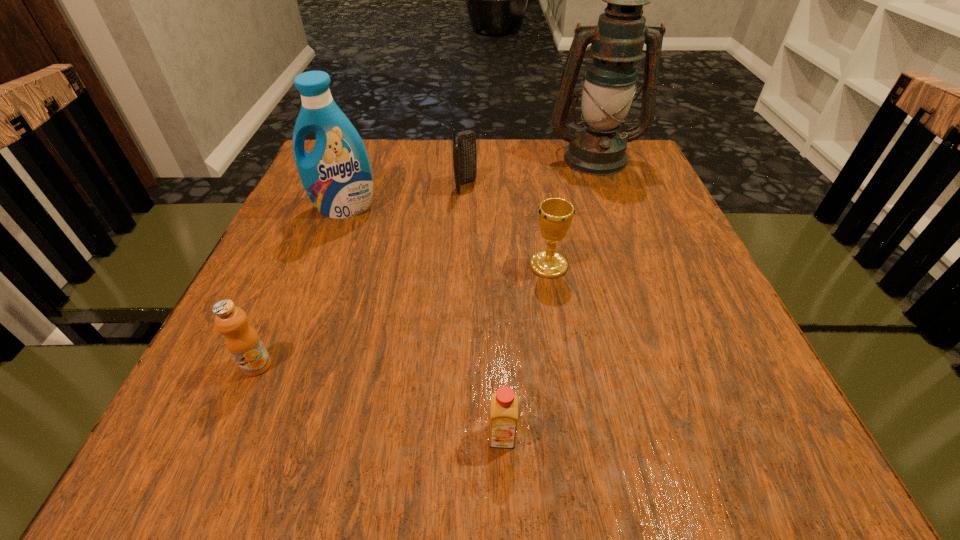
Where is `detergent present at the left edge`? The width and height of the screenshot is (960, 540). detergent present at the left edge is located at coordinates (336, 175).

This screenshot has width=960, height=540. I want to click on orange juice that is at the left edge, so click(x=242, y=340).

The width and height of the screenshot is (960, 540). What are the coordinates of `object that is at the right edge` in the screenshot? It's located at (617, 41).

Where is `object that is at the far right corner`? This screenshot has width=960, height=540. object that is at the far right corner is located at coordinates (617, 41).

This screenshot has width=960, height=540. In order to click on blank space at the far edge of the desktop in this screenshot , I will do `click(535, 158)`.

Locate an element on the screen. The width and height of the screenshot is (960, 540). vacant space at the left edge is located at coordinates (315, 315).

You are a GUI agent. You are given a task and a screenshot of the screen. Output one action in this format:
    pyautogui.click(x=<x>, y=<y>)
    Task: Click on the vacant space at the right edge of the desktop
    This screenshot has height=540, width=960.
    Given the screenshot: What is the action you would take?
    pyautogui.click(x=686, y=234)

Where is `free space at the far left corner`? Image resolution: width=960 pixels, height=540 pixels. free space at the far left corner is located at coordinates [x=369, y=145].

In the image, there is a desktop. Where is `vacant space at the near left corner`? This screenshot has width=960, height=540. vacant space at the near left corner is located at coordinates (159, 452).

Find the location of `free point between the shorter orange juice and the rightmost object`. free point between the shorter orange juice and the rightmost object is located at coordinates (548, 296).